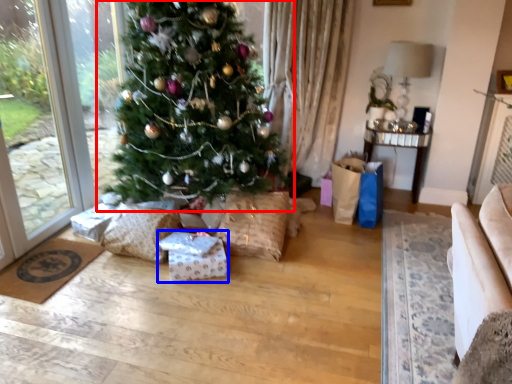
Question: Which point is further to the camera, christmas tree (highlighted by a red box) or package (highlighted by a blue box)?

Choices:
 (A) christmas tree
 (B) package

Answer: (B)